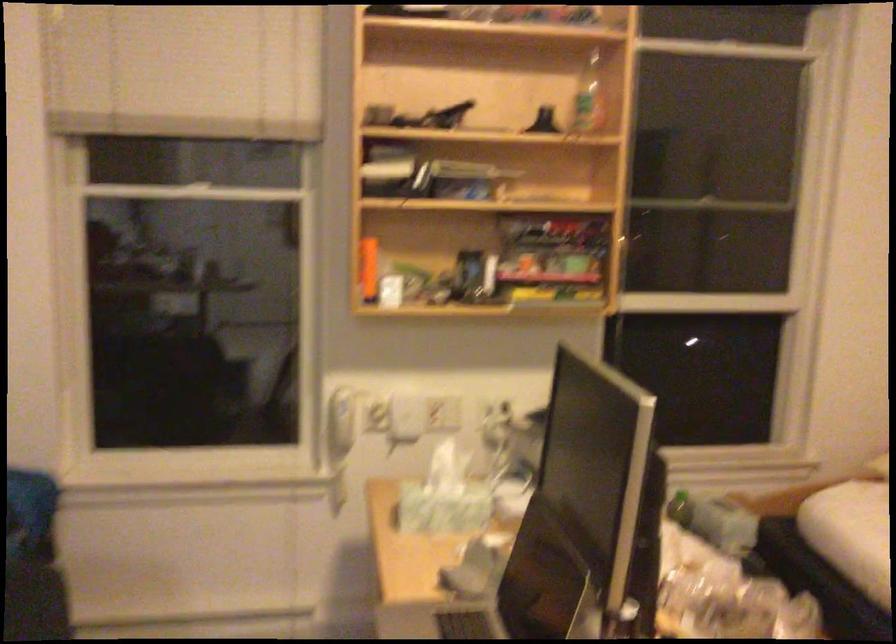
Question: The images are taken continuously from a first-person perspective. In which direction is your viewpoint rotating?

Choices:
 (A) Left
 (B) Right
 (C) Up
 (D) Down

Answer: (A)